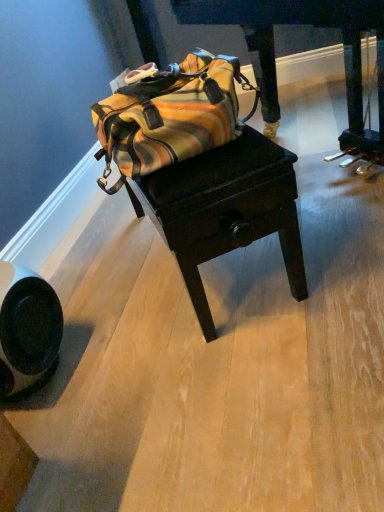
Identify the location of free spot to the left of wooden table at center. This screenshot has width=384, height=512. (106, 277).